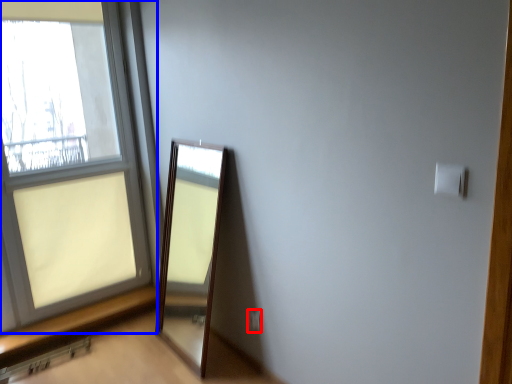
Question: Among these objects, which one is farthest to the camera, electric outlet (highlighted by a red box) or window (highlighted by a blue box)?

Choices:
 (A) electric outlet
 (B) window

Answer: (A)